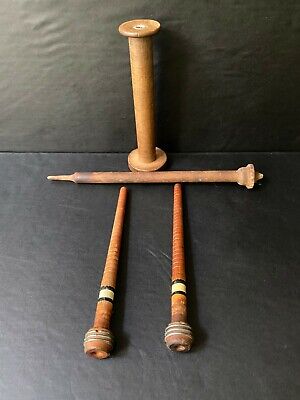
I want to click on music equipment, so click(106, 296).